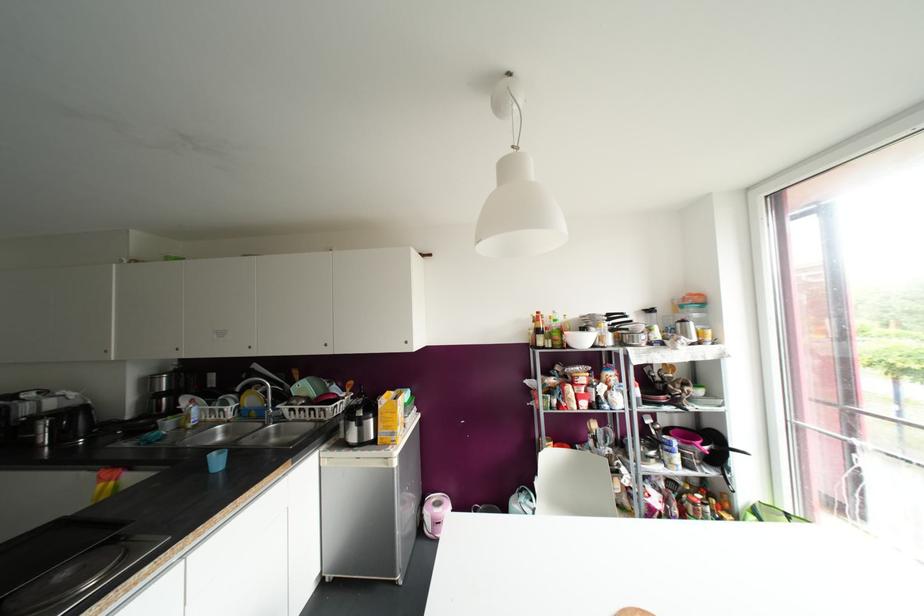
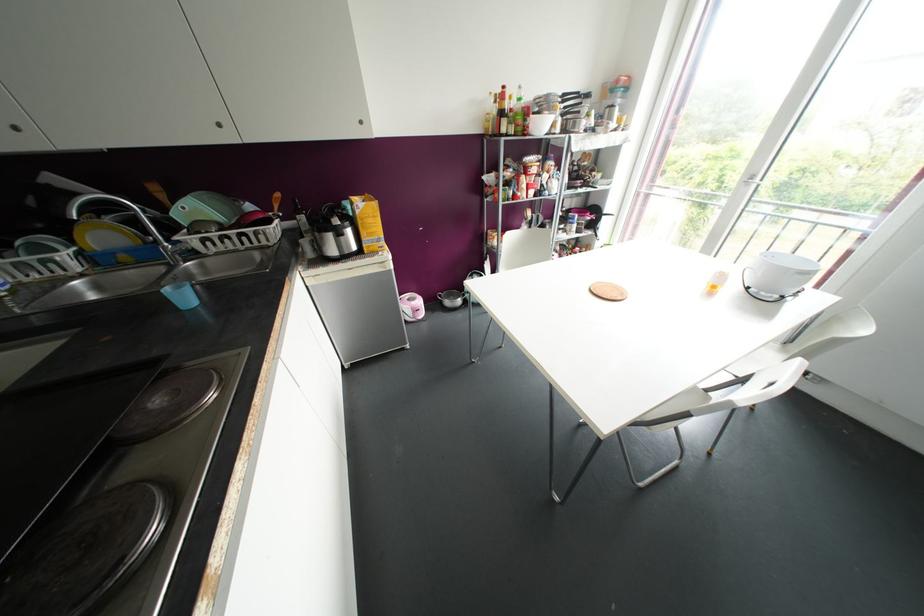
The point at (216, 462) is marked in the first image. Where is the corresponding point in the second image?

(184, 297)